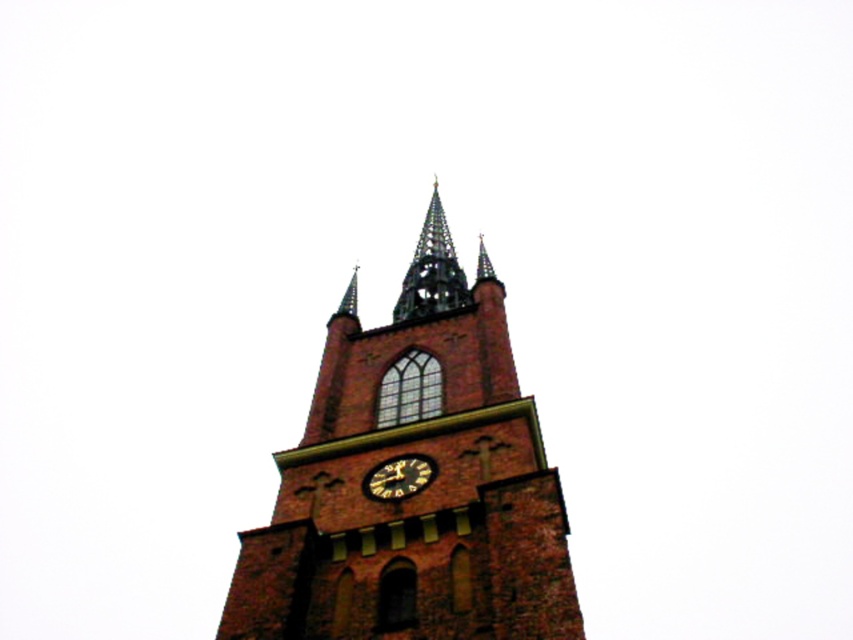
Question: Which point is closer to the camera?

Choices:
 (A) gold textured clock at center
 (B) brick tower at center

Answer: (B)

Question: Which object is closer to the camera taking this photo?

Choices:
 (A) dark gray stone spire at upper center
 (B) gold textured clock at center
 (C) brick tower at center

Answer: (C)

Question: Does brick tower at center appear on the left side of gold textured clock at center?

Choices:
 (A) yes
 (B) no

Answer: (B)

Question: Can you confirm if brick tower at center is bigger than dark gray stone spire at upper center?

Choices:
 (A) yes
 (B) no

Answer: (A)

Question: Based on their relative distances, which object is farther from the gold textured clock at center?

Choices:
 (A) brick tower at center
 (B) dark gray stone spire at upper center

Answer: (B)

Question: Does dark gray stone spire at upper center come in front of gold textured clock at center?

Choices:
 (A) yes
 (B) no

Answer: (B)